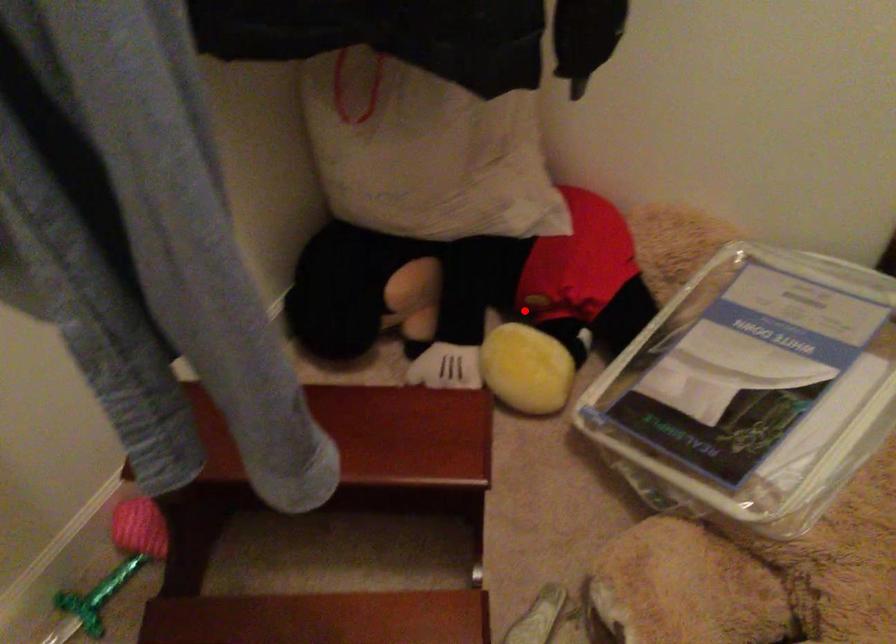
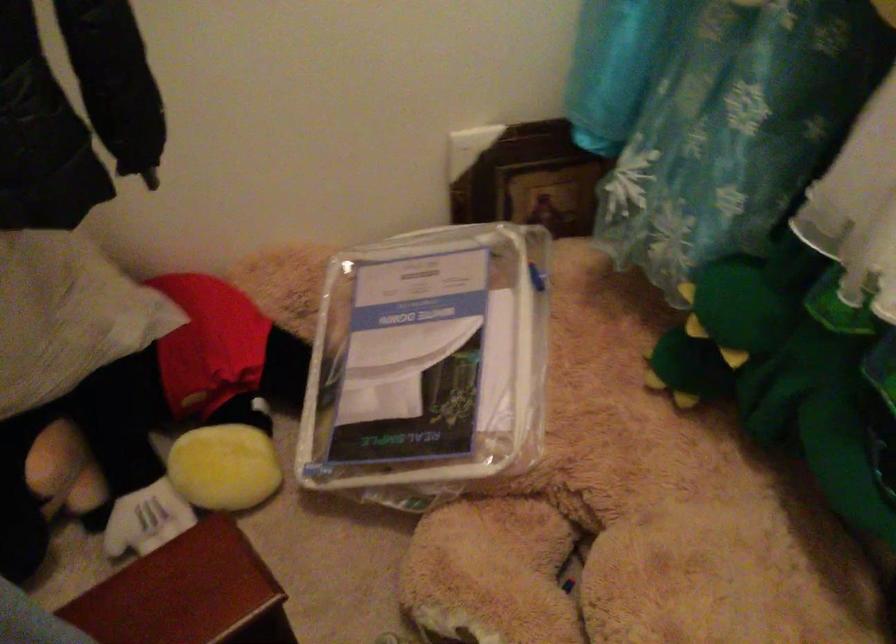
Question: I am providing you with two images of the same scene from different viewpoints. A red point is marked on the first image. Can you still see the location of the red point in image 2?

Choices:
 (A) Yes
 (B) No

Answer: (A)